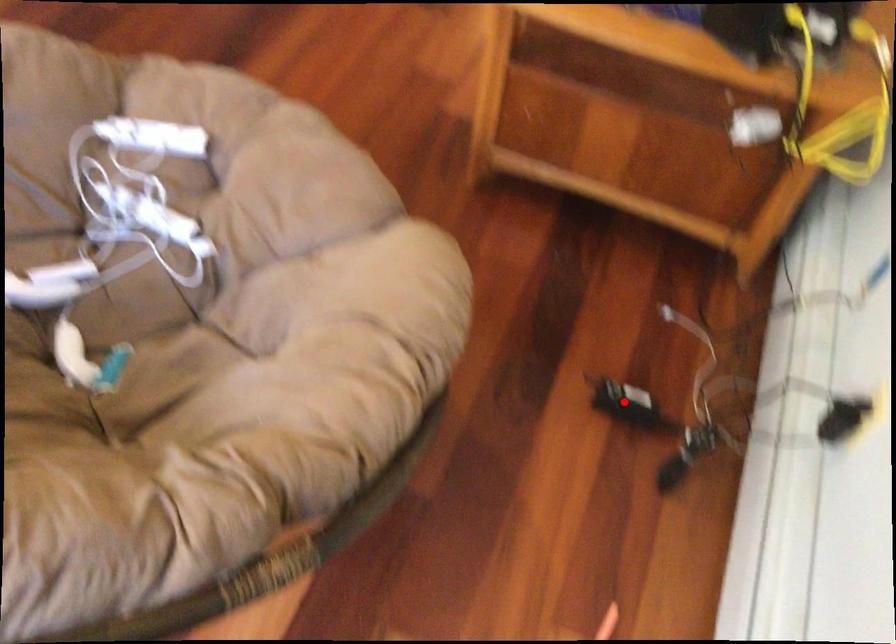
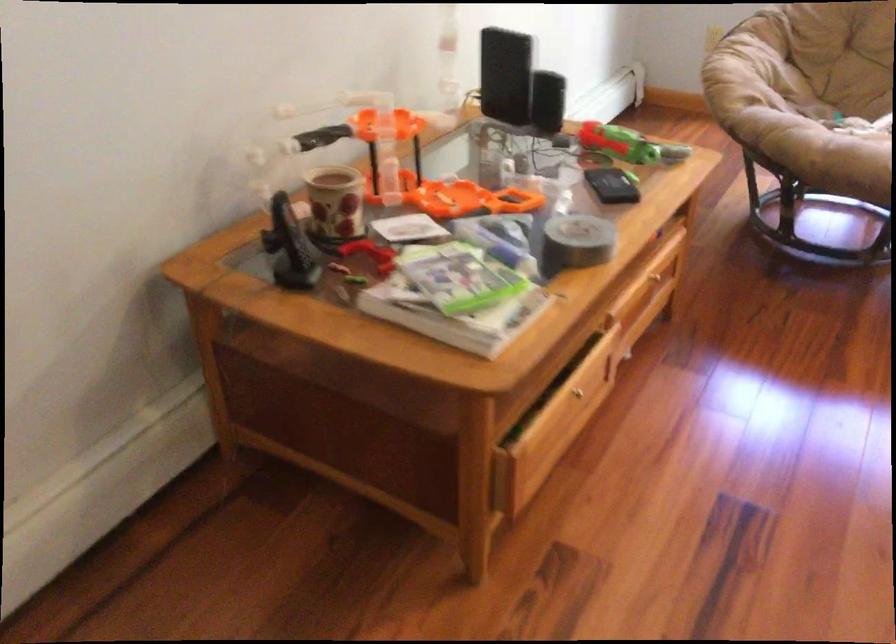
Question: I am providing you with two images of the same scene from different viewpoints. A red point is marked on the first image. At the location where the point appears in image 1, is it still visible in image 2?

Choices:
 (A) Yes
 (B) No

Answer: (B)